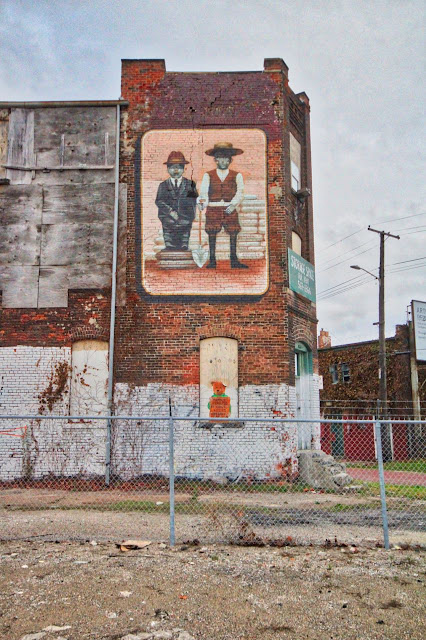
The width and height of the screenshot is (426, 640). What are the coordinates of `teddy bear` in the screenshot? It's located at (222, 386).